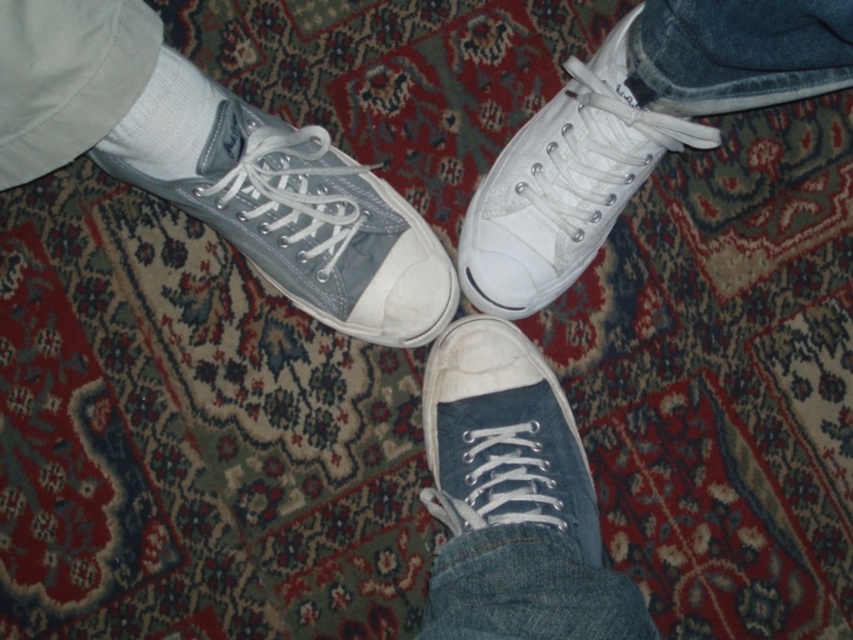
Question: Is white canvas shoe at lower center wider than white cotton sock at upper left?

Choices:
 (A) no
 (B) yes

Answer: (B)

Question: Which is nearer to the white cotton sock at upper left?

Choices:
 (A) gray canvas shoe at left
 (B) white canvas shoe at lower center

Answer: (A)

Question: Observing the image, what is the correct spatial positioning of white canvas shoe at upper right in reference to white canvas shoe at lower center?

Choices:
 (A) left
 (B) right

Answer: (B)

Question: Does gray canvas shoe at left have a greater width compared to white canvas shoe at upper right?

Choices:
 (A) no
 (B) yes

Answer: (B)

Question: Which point appears closest to the camera in this image?

Choices:
 (A) (189, 148)
 (B) (532, 349)
 (C) (294, 140)
 (D) (589, 150)

Answer: (A)

Question: Among these points, which one is nearest to the camera?

Choices:
 (A) (467, 460)
 (B) (140, 138)
 (C) (619, 97)
 (D) (328, 150)

Answer: (B)